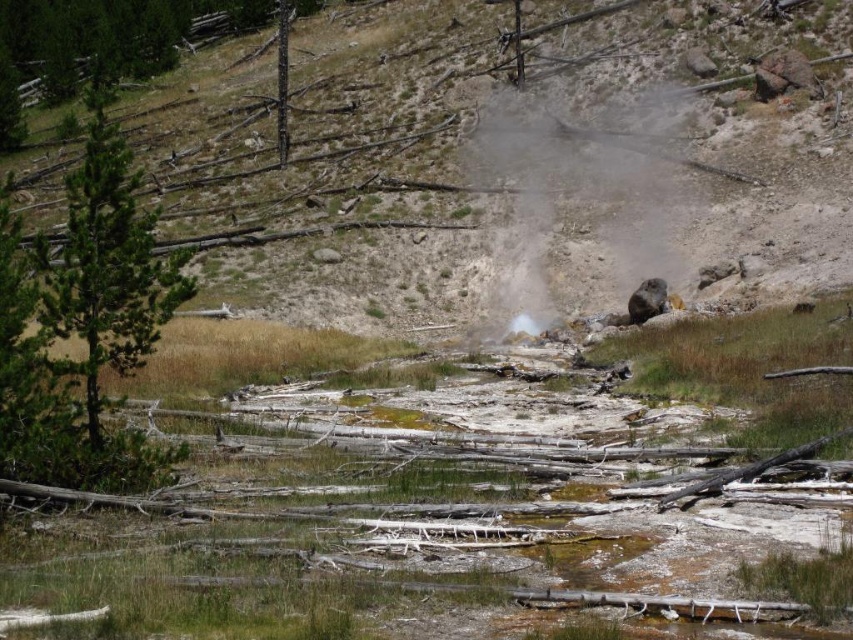
You are standing at the point marked by point [517,164] in a geothermal area. What type of terrain are you currently on?

You are on the brown dirt hillside at center, which is represented by point [517,164].

You are a hiker trying to navigate through the geothermal area. You see the gray dusty rock at center and the green textured pine tree at left. Which object is shorter?

The gray dusty rock at center is shorter than the green textured pine tree at left.